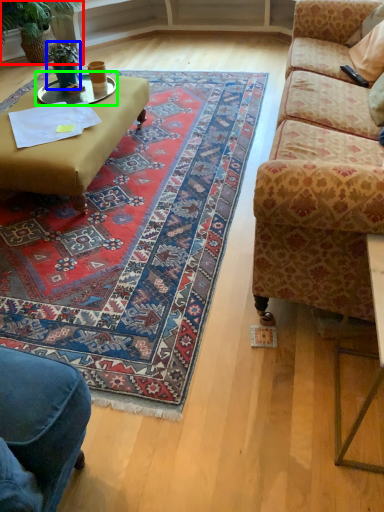
Question: Estimate the real-world distances between objects in this image. Which object is farther from houseplant (highlighted by a red box), houseplant (highlighted by a blue box) or glass table (highlighted by a green box)?

Choices:
 (A) houseplant
 (B) glass table

Answer: (B)